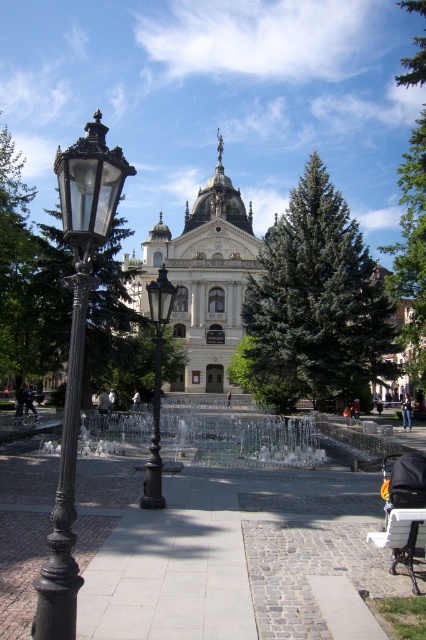
You are a tourist visiting this historic building. You see the clear glass water at center and the jeans at center. Which object is bigger in size?

The clear glass water at center is larger in size compared to the jeans at center.